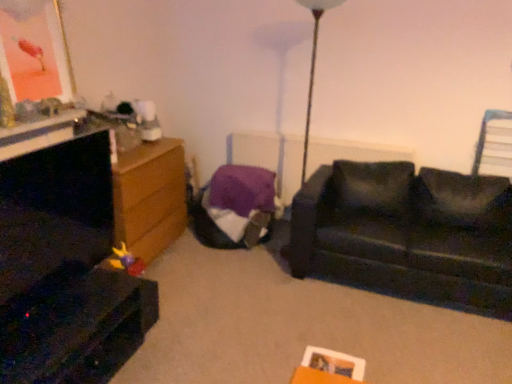
Image resolution: width=512 pixels, height=384 pixels. What are the coordinates of `unoccupied region to the right of wooden chest of drawers at left` in the screenshot? It's located at (189, 266).